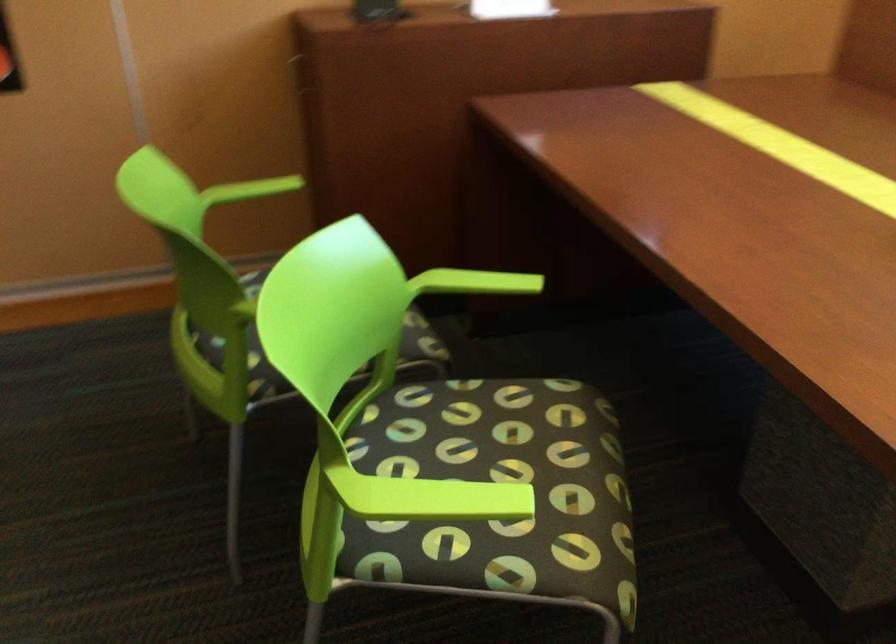
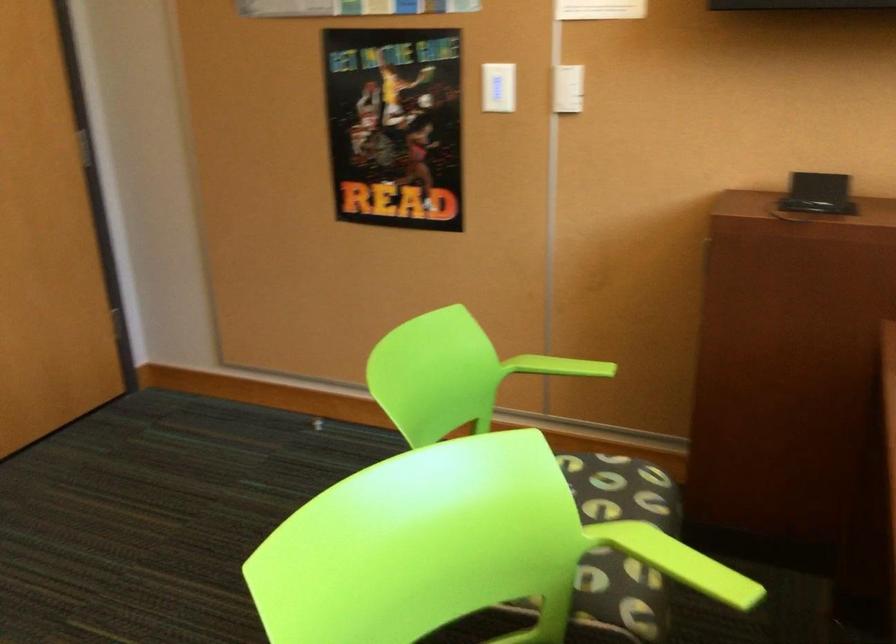
Question: The images are taken continuously from a first-person perspective. In which direction is your viewpoint rotating?

Choices:
 (A) Left
 (B) Right
 (C) Up
 (D) Down

Answer: (A)